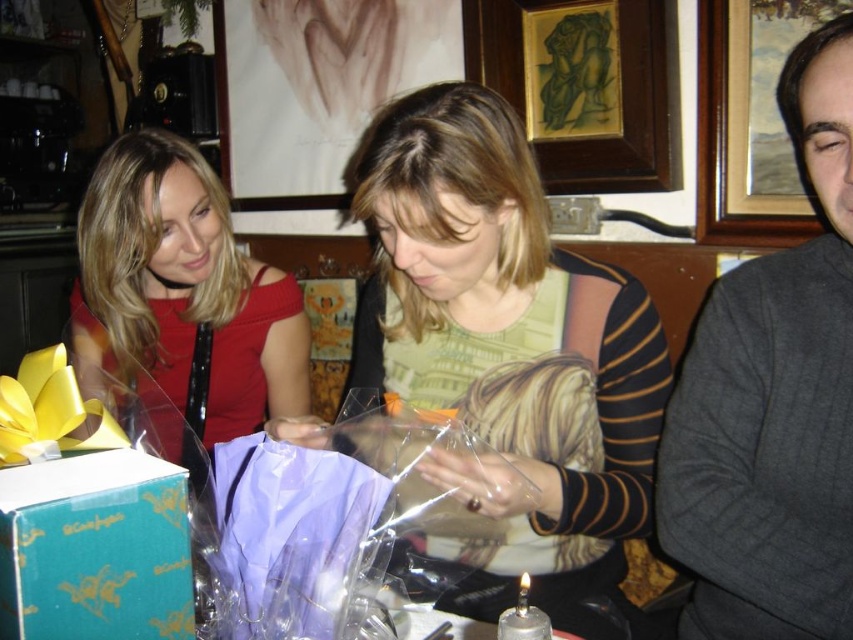
Does matte green sweater at center have a greater height compared to matte red dress at left?

Yes.

Find the location of `matte green sweater at center`. matte green sweater at center is located at coordinates (506, 337).

Based on the photo, which is below, matte green sweater at center or gray textured sweater at right?

matte green sweater at center is below.

Is point (492, 221) more distant than point (779, 106)?

No, it is in front of (779, 106).

Locate an element on the screen. This screenshot has height=640, width=853. matte green sweater at center is located at coordinates (506, 337).

Can you confirm if gray textured sweater at right is positioned to the left of purple satin shirt at center?

In fact, gray textured sweater at right is to the right of purple satin shirt at center.

Measure the distance from gray textured sweater at right to purple satin shirt at center.

A distance of 20.33 inches exists between gray textured sweater at right and purple satin shirt at center.

Is point (849, 444) positioned behind point (360, 548)?

Yes, point (849, 444) is behind point (360, 548).

The image size is (853, 640). Identify the location of gray textured sweater at right. (773, 403).